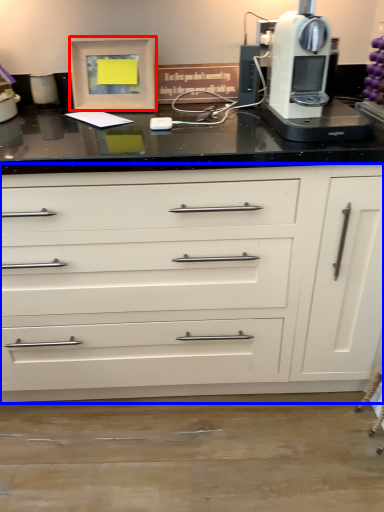
Question: Among these objects, which one is nearest to the camera, picture frame (highlighted by a red box) or chest of drawers (highlighted by a blue box)?

Choices:
 (A) picture frame
 (B) chest of drawers

Answer: (B)